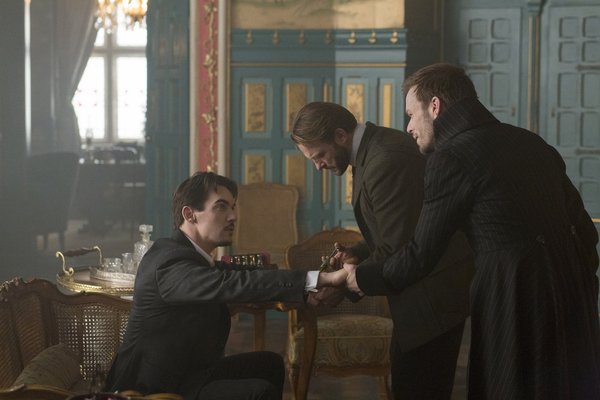
At what (x,y) coordinates should I click in order to perform the action: click on door. Please return your answer as a coordinate pair (x, y). The width and height of the screenshot is (600, 400). Looking at the image, I should click on (488, 72).